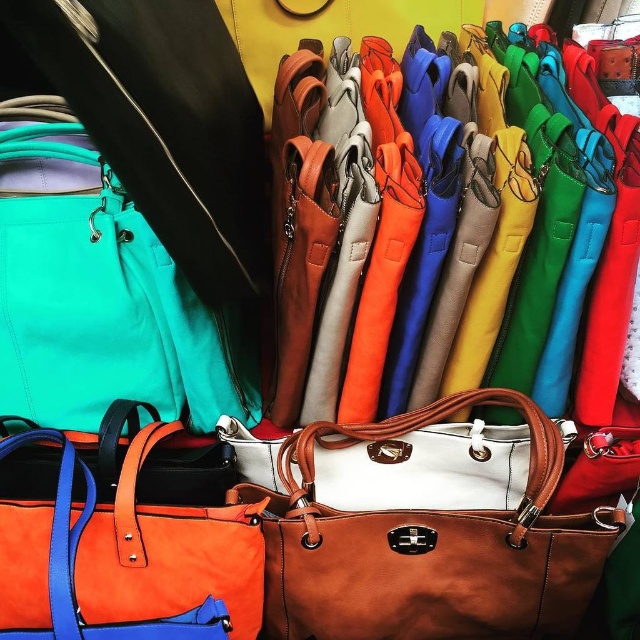
Question: Does brown leather tote at center appear over orange leather tote at center?

Choices:
 (A) no
 (B) yes

Answer: (A)

Question: Is brown leather tote at center smaller than orange leather tote at center?

Choices:
 (A) yes
 (B) no

Answer: (B)

Question: Which point is farther to the camera?

Choices:
 (A) (237, 513)
 (B) (336, 428)

Answer: (B)

Question: Is brown leather tote at center thinner than orange leather tote at center?

Choices:
 (A) no
 (B) yes

Answer: (A)

Question: Which of the following is the closest to the observer?

Choices:
 (A) pyautogui.click(x=120, y=480)
 (B) pyautogui.click(x=324, y=515)

Answer: (A)

Question: Which point is closer to the camera?

Choices:
 (A) orange leather tote at center
 (B) brown leather tote at center

Answer: (A)